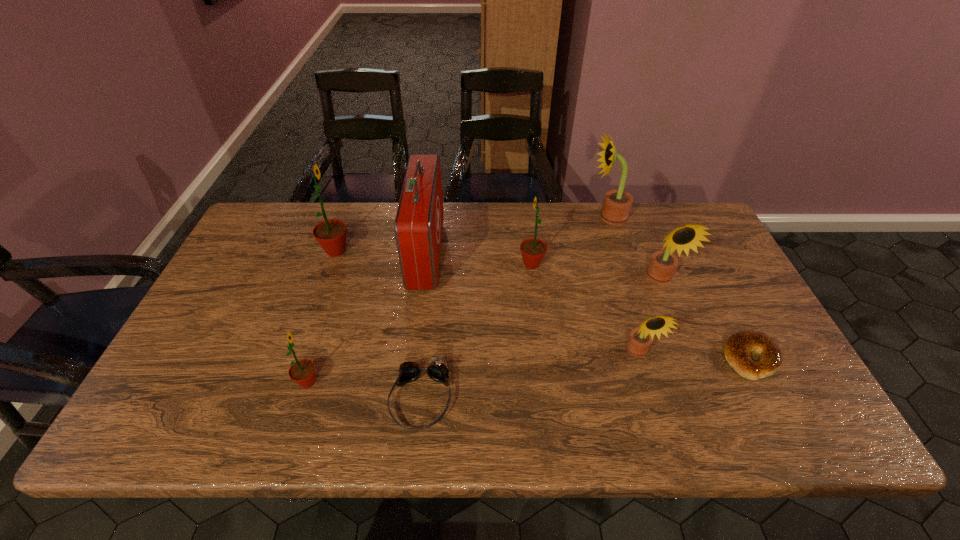
This screenshot has width=960, height=540. In order to click on vacant space at the far edge in this screenshot , I will do `click(352, 243)`.

In the image, there is a desktop. At what (x,y) coordinates should I click in order to perform the action: click on vacant space at the near edge. Please return your answer as a coordinate pair (x, y). This screenshot has width=960, height=540. Looking at the image, I should click on (600, 418).

Where is `vacant space at the left edge of the desktop`? vacant space at the left edge of the desktop is located at coordinates (195, 356).

In order to click on vacant region at the right edge in this screenshot , I will do `click(709, 292)`.

This screenshot has width=960, height=540. In the image, there is a desktop. Find the location of `vacant space at the far left corner`. vacant space at the far left corner is located at coordinates (286, 235).

Where is `free space between the biggest green sunflower and the bronze goggles`? The height and width of the screenshot is (540, 960). free space between the biggest green sunflower and the bronze goggles is located at coordinates (378, 325).

Locate an element on the screen. The image size is (960, 540). unoccupied area between the smallest yellow sunflower and the farthest sunflower is located at coordinates (623, 285).

The height and width of the screenshot is (540, 960). I want to click on free space that is in between the nearest yellow sunflower and the red first-aid kit, so [532, 303].

Identify the location of free area in between the nearest green sunflower and the smallest yellow sunflower. Image resolution: width=960 pixels, height=540 pixels. (473, 367).

Where is `free space between the fifth object from left to right and the second farthest yellow sunflower`? The height and width of the screenshot is (540, 960). free space between the fifth object from left to right and the second farthest yellow sunflower is located at coordinates (596, 272).